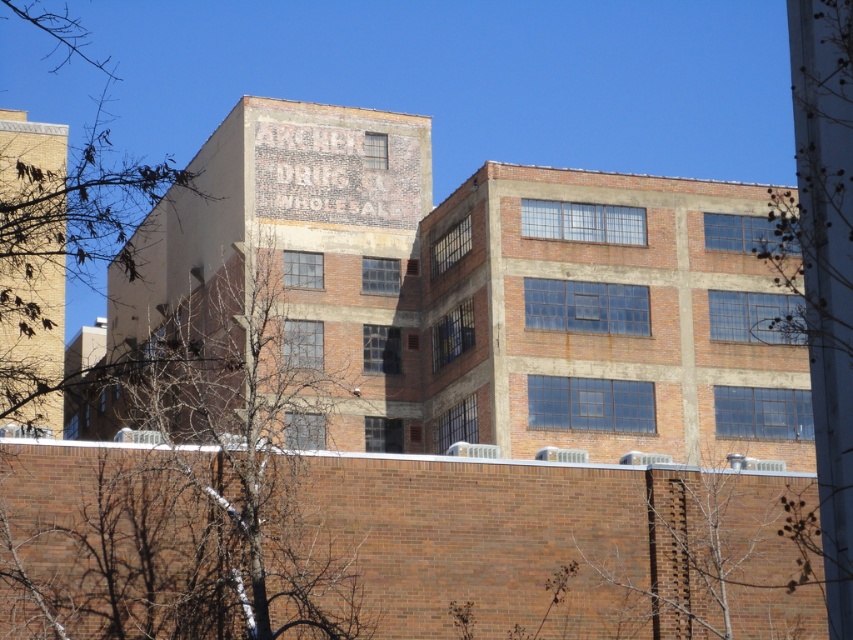
Who is positioned more to the right, bare branches at center or brown textured tree at lower right?

From the viewer's perspective, brown textured tree at lower right appears more on the right side.

Between point (113, 316) and point (610, 572), which one is positioned in front?

Positioned in front is point (610, 572).

Locate an element on the screen. Image resolution: width=853 pixels, height=640 pixels. bare branches at center is located at coordinates (236, 444).

Is point (653, 564) positioned in front of point (815, 22)?

That is False.

Can you confirm if brown textured tree at lower right is wider than bare branches at right?

No, brown textured tree at lower right is not wider than bare branches at right.

Is point (737, 532) positioned before point (840, 563)?

No, it is behind (840, 563).

Image resolution: width=853 pixels, height=640 pixels. I want to click on brown textured tree at lower right, so click(718, 554).

Measure the distance from bare branches at center to bare branches at right.

bare branches at center is 26.07 meters from bare branches at right.

Does bare branches at center lie in front of bare branches at right?

No, it is behind bare branches at right.

Does point (257, 570) come behind point (849, 540)?

Yes, it is.

Locate an element on the screen. The width and height of the screenshot is (853, 640). bare branches at center is located at coordinates (236, 444).